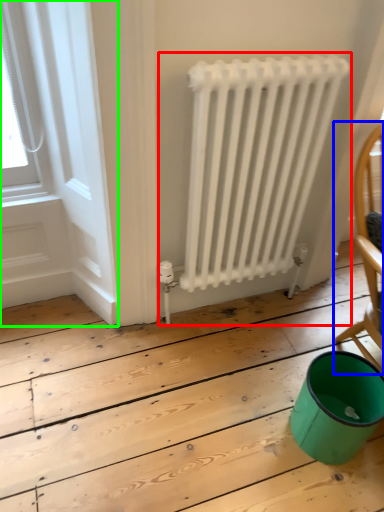
Question: Considering the real-world distances, which object is farthest from radiator (highlighted by a red box)? chair (highlighted by a blue box) or window frame (highlighted by a green box)?

Choices:
 (A) chair
 (B) window frame

Answer: (B)